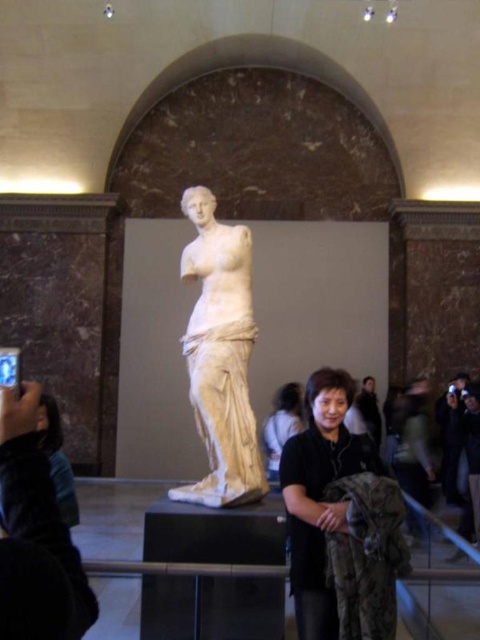
Question: Is matte black jacket at lower center smaller than black matte jacket at center?

Choices:
 (A) no
 (B) yes

Answer: (B)

Question: Which point is closer to the camera?

Choices:
 (A) matte black jacket at lower center
 (B) black matte shirt at center
 (C) black matte jacket at center
 (D) dark green fabric at lower right

Answer: (B)

Question: Considering the real-world distances, which object is closest to the dark green fabric at lower right?

Choices:
 (A) white marble statue at center
 (B) black matte shirt at center
 (C) black matte jacket at center
 (D) black fabric at left

Answer: (C)

Question: Among these objects, which one is nearest to the camera?

Choices:
 (A) matte black jacket at lower center
 (B) black fabric at left
 (C) dark green fabric at lower right
 (D) white marble statue at center

Answer: (B)

Question: Considering the relative positions of black fabric at left and dark green fabric at lower right in the image provided, where is black fabric at left located with respect to dark green fabric at lower right?

Choices:
 (A) above
 (B) below

Answer: (A)

Question: Does black matte shirt at center have a lesser width compared to dark green fabric at lower right?

Choices:
 (A) no
 (B) yes

Answer: (B)